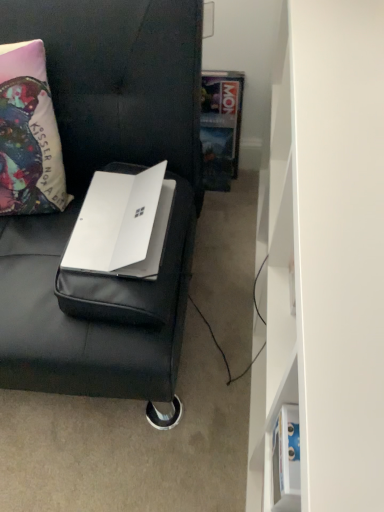
Question: From a real-world perspective, is hardcover book at center physically above white matte bookshelf at right?

Choices:
 (A) no
 (B) yes

Answer: (A)

Question: From a real-world perspective, is hardcover book at center below white matte bookshelf at right?

Choices:
 (A) no
 (B) yes

Answer: (B)

Question: Can you confirm if hardcover book at center is positioned to the right of white matte bookshelf at right?

Choices:
 (A) no
 (B) yes

Answer: (A)

Question: Considering the relative sizes of hardcover book at center and white matte bookshelf at right in the image provided, is hardcover book at center thinner than white matte bookshelf at right?

Choices:
 (A) no
 (B) yes

Answer: (B)

Question: Is hardcover book at center smaller than white matte bookshelf at right?

Choices:
 (A) no
 (B) yes

Answer: (B)

Question: Can you confirm if hardcover book at center is shorter than white matte bookshelf at right?

Choices:
 (A) no
 (B) yes

Answer: (B)

Question: Is white matte bookshelf at right to the left of white matte laptop at left from the viewer's perspective?

Choices:
 (A) yes
 (B) no

Answer: (B)

Question: Is white matte laptop at left at the back of white matte bookshelf at right?

Choices:
 (A) yes
 (B) no

Answer: (A)

Question: Is white matte bookshelf at right not inside white matte laptop at left?

Choices:
 (A) no
 (B) yes

Answer: (B)

Question: Does white matte bookshelf at right have a lesser width compared to white matte laptop at left?

Choices:
 (A) yes
 (B) no

Answer: (A)

Question: From a real-world perspective, is white matte bookshelf at right under white matte laptop at left?

Choices:
 (A) no
 (B) yes

Answer: (B)

Question: Is white matte bookshelf at right far from white matte laptop at left?

Choices:
 (A) no
 (B) yes

Answer: (A)

Question: Can we say white matte bookshelf at right lies outside hardcover book at center?

Choices:
 (A) no
 (B) yes

Answer: (B)